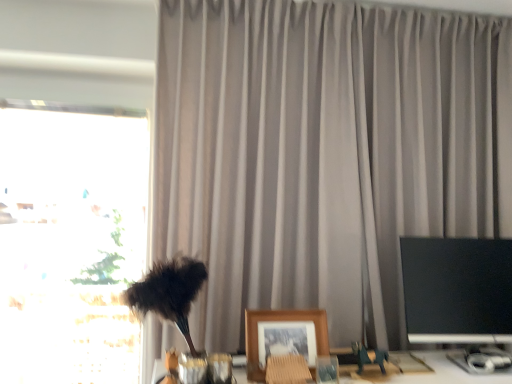
Question: From a real-world perspective, relative to transparent glass window at left, is black glossy monitor at right vertically above or below?

Choices:
 (A) above
 (B) below

Answer: (B)

Question: From the image's perspective, is black glossy monitor at right above or below transparent glass window at left?

Choices:
 (A) below
 (B) above

Answer: (A)

Question: Estimate the real-world distances between objects in this image. Which object is farther from the metallic green toy horse at lower right?

Choices:
 (A) transparent glass window at left
 (B) black glossy monitor at right
 (C) wooden framed photo at center
 (D) matte gray curtain at center

Answer: (A)

Question: Which of these objects is positioned closest to the black glossy monitor at right?

Choices:
 (A) wooden framed photo at center
 (B) transparent glass window at left
 (C) metallic green toy horse at lower right
 (D) matte gray curtain at center

Answer: (C)